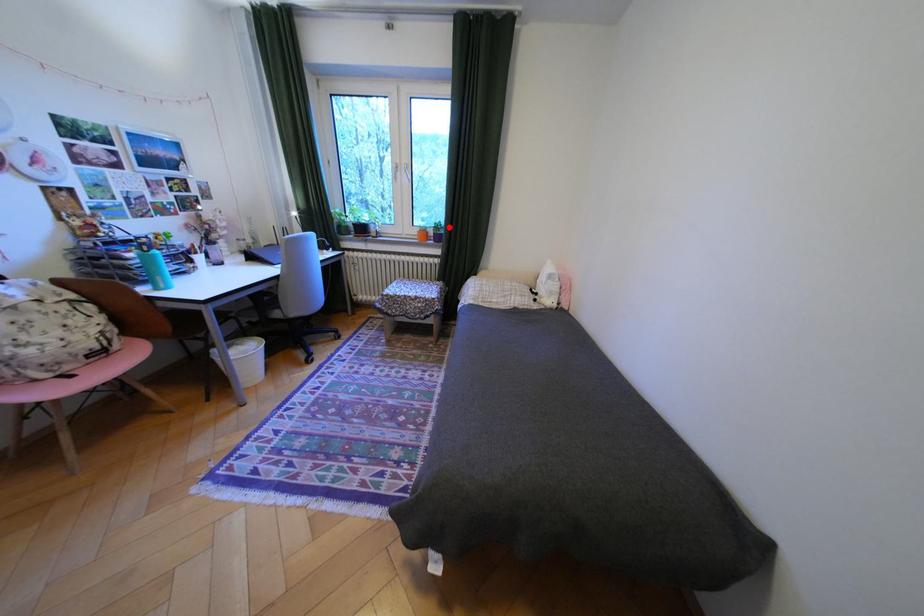
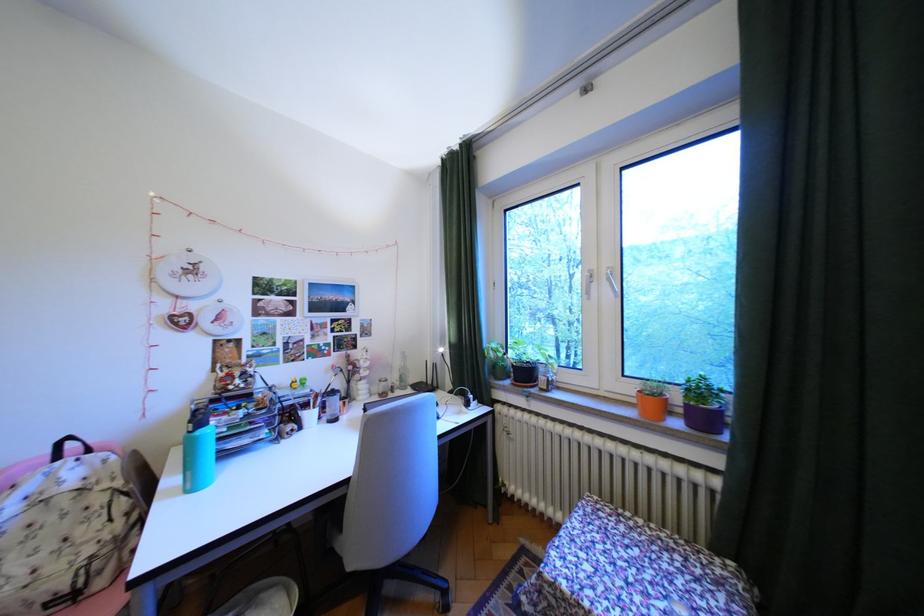
Find the pixel in the second image that matches the highlighted location in the first image.

(710, 391)